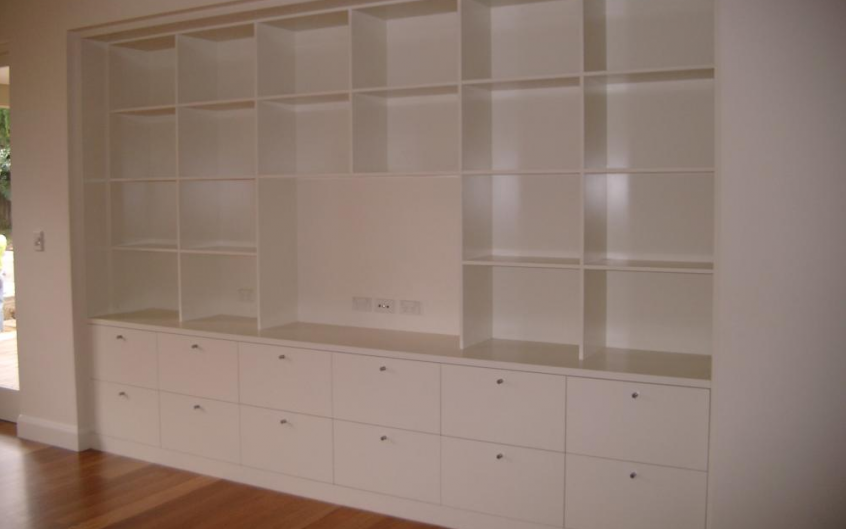
At what (x,y) coordinates should I click in order to perform the action: click on bottom drawers. Please return your answer as a coordinate pair (x, y). The height and width of the screenshot is (529, 846). Looking at the image, I should click on (130, 423), (194, 431), (325, 450), (360, 462), (486, 480), (645, 492).